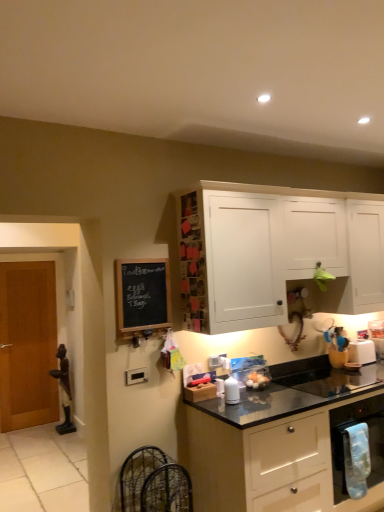
Question: From the image's perspective, is blue fabric towel at lower right above or below white plastic toaster at right, which appears as the 2th appliance when viewed from the left?

Choices:
 (A) above
 (B) below

Answer: (B)

Question: Considering their positions, is blue fabric towel at lower right located in front of or behind white plastic toaster at right, which is the 2th appliance in front-to-back order?

Choices:
 (A) behind
 (B) front

Answer: (B)

Question: Based on their relative distances, which object is nearer to the black chalkboard at left?

Choices:
 (A) blue fabric towel at lower right
 (B) white matte cabinet at upper center, which is the 2th cabinetry in bottom-to-top order
 (C) black matte countertop at lower right, the 2th cabinetry positioned from the top
 (D) wooden door at left
 (E) white plastic toaster at right, which appears as the 1th appliance when viewed from the back

Answer: (B)

Question: Which object is the closest to the black granite sink at lower right?

Choices:
 (A) black chalkboard at left
 (B) blue fabric towel at lower right
 (C) wooden door at left
 (D) white glossy salt shaker at center, the 2th appliance in the back-to-front sequence
 (E) white plastic toaster at right, which appears as the 2th appliance when viewed from the left

Answer: (E)